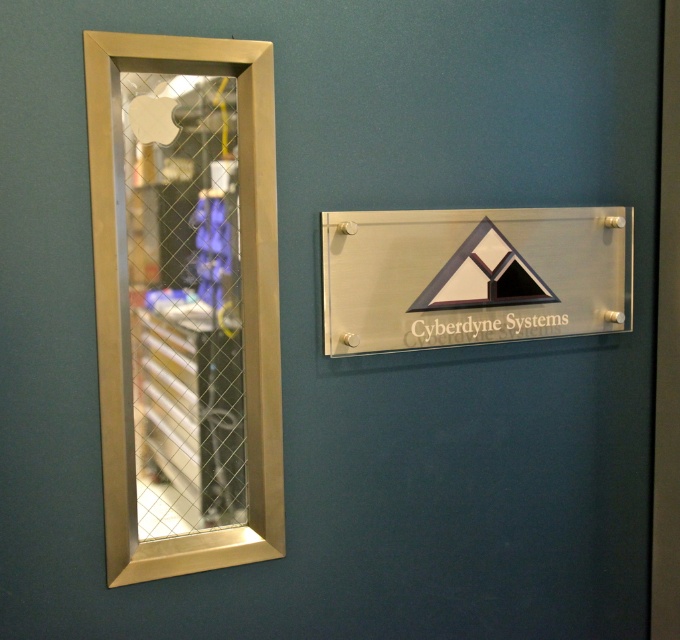
You are standing in front of the wall with the brushed metal elevator at left and the clear acrylic sign at center. Which object takes up more space on the wall?

The brushed metal elevator at left is bigger than the clear acrylic sign at center, so it takes up more space on the wall.

You are standing in a hallway and see the image. You need to locate the brushed metal elevator at left. What are its coordinates?

The coordinates of the brushed metal elevator at left are at point (184, 298).

You are standing in a hallway and see the brushed metal elevator at left and the clear acrylic sign at center. Which object is closer to you?

The brushed metal elevator at left is closer to you because it is in front of the clear acrylic sign at center.